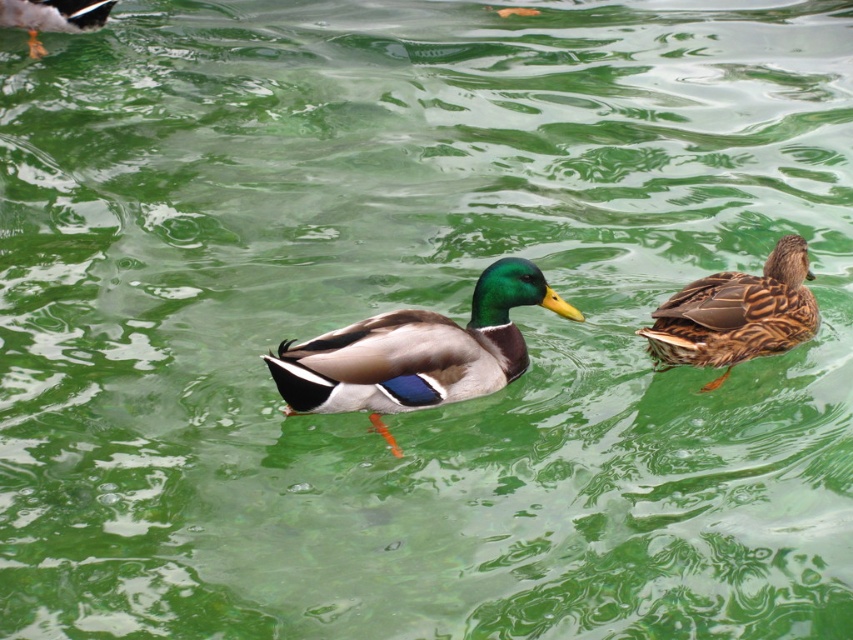
Is brown textured duck at right taller than shiny black duck at upper left?

Indeed, brown textured duck at right has a greater height compared to shiny black duck at upper left.

Is brown textured duck at right below shiny black duck at upper left?

Yes.

Which is in front, point (701, 316) or point (73, 12)?

Point (701, 316) is more forward.

You are a GUI agent. You are given a task and a screenshot of the screen. Output one action in this format:
    pyautogui.click(x=<x>, y=<y>)
    Task: Click on the brown textured duck at right
    This screenshot has width=853, height=640.
    Given the screenshot: What is the action you would take?
    pyautogui.click(x=735, y=314)

Can you confirm if shiny green duck at center is positioned below brown textured duck at right?

Yes.

Does shiny green duck at center have a greater height compared to brown textured duck at right?

Correct, shiny green duck at center is much taller as brown textured duck at right.

Is point (491, 349) positioned before point (705, 317)?

Yes.

The height and width of the screenshot is (640, 853). I want to click on shiny green duck at center, so click(416, 353).

Which is more to the left, shiny green duck at center or shiny black duck at upper left?

shiny black duck at upper left is more to the left.

Describe the element at coordinates (416, 353) in the screenshot. Image resolution: width=853 pixels, height=640 pixels. I see `shiny green duck at center` at that location.

Locate an element on the screen. The width and height of the screenshot is (853, 640). shiny green duck at center is located at coordinates (416, 353).